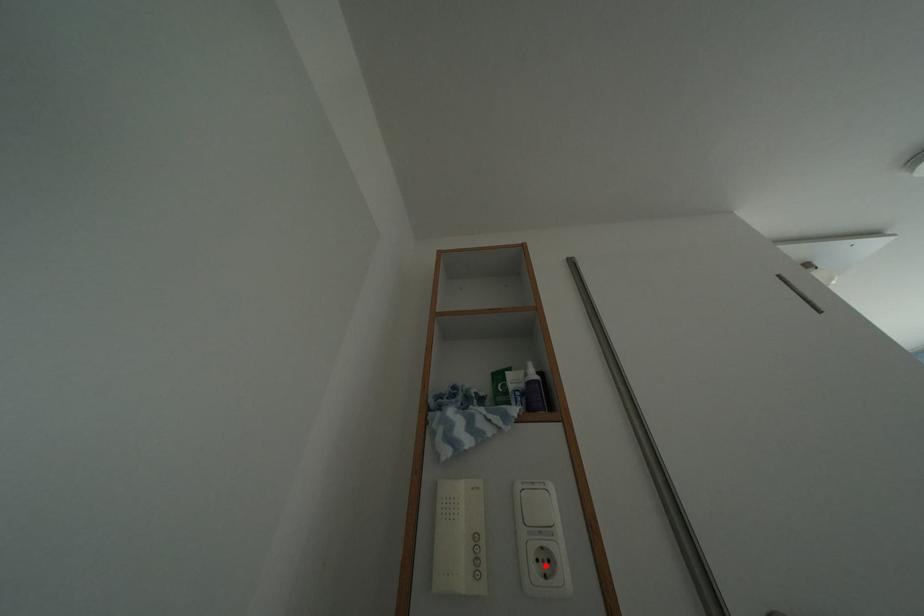
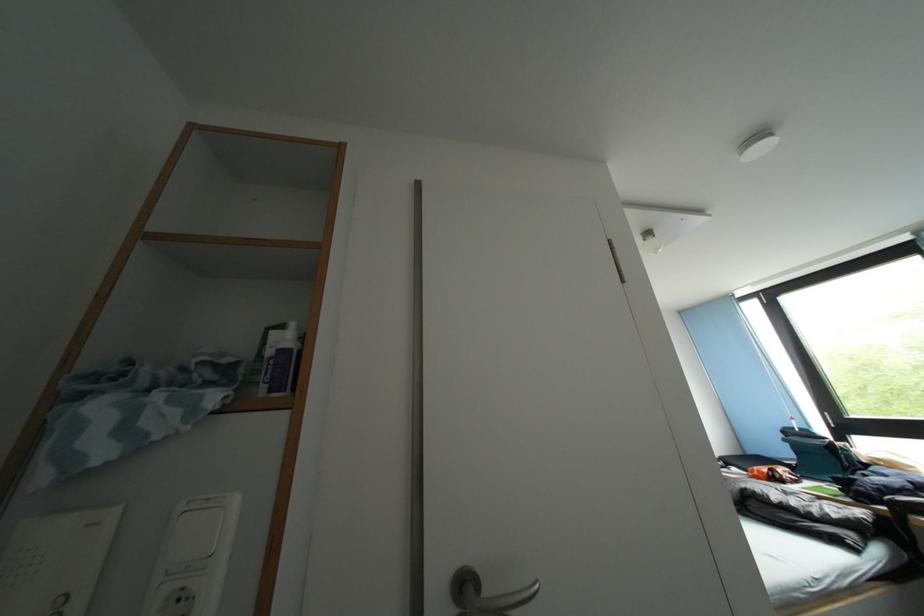
Find the pixel in the second image that matches the highlighted location in the first image.

(188, 604)